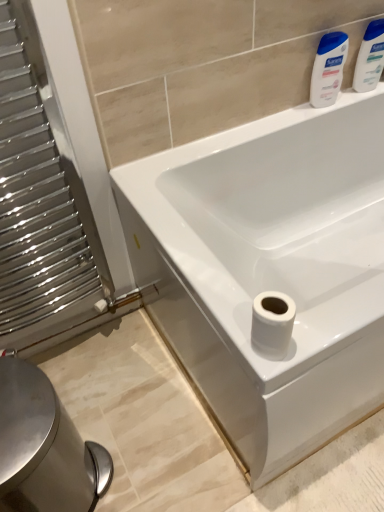
Question: Considering their positions, is polished metal radiator at left located in front of or behind white glossy bathtub at center?

Choices:
 (A) front
 (B) behind

Answer: (A)

Question: From the image's perspective, is polished metal radiator at left located above or below white glossy bathtub at center?

Choices:
 (A) below
 (B) above

Answer: (B)

Question: Based on their relative distances, which object is farther from the silver metallic bidet at lower left?

Choices:
 (A) white matte toilet paper at lower right
 (B) white glossy lotion at upper right, which is counted as the 1th cleaning product, starting from the left
 (C) white glossy bathtub at center
 (D) polished metal radiator at left
 (E) blue plastic bottles at upper right, positioned as the 1th cleaning product in right-to-left order

Answer: (E)

Question: Which is nearer to the white glossy lotion at upper right, positioned as the 2th cleaning product in right-to-left order?

Choices:
 (A) silver metallic bidet at lower left
 (B) white glossy bathtub at center
 (C) polished metal radiator at left
 (D) blue plastic bottles at upper right, positioned as the 1th cleaning product in right-to-left order
 (E) white matte toilet paper at lower right

Answer: (D)